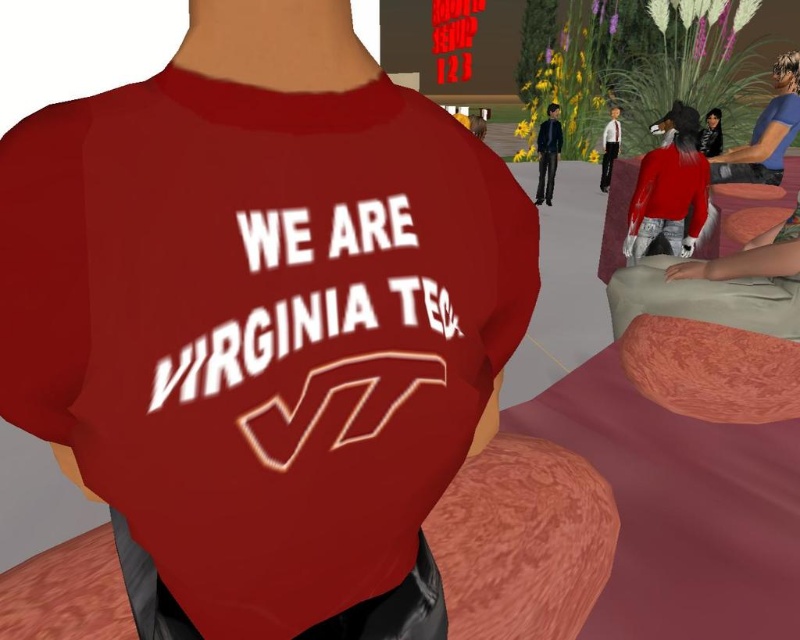
Which is behind, point (700, 168) or point (604, 189)?

The point (604, 189) is behind.

Between matte red shirt at center and matte white shirt at upper right, which one is positioned higher?

matte white shirt at upper right

Locate an element on the screen. matte red shirt at center is located at coordinates (670, 189).

Measure the distance between matte red shirt at center and camera.

The distance of matte red shirt at center from camera is 3.32 meters.

Does matte red shirt at center have a greater width compared to shiny black jacket at upper right?

In fact, matte red shirt at center might be narrower than shiny black jacket at upper right.

Locate an element on the screen. The width and height of the screenshot is (800, 640). matte red shirt at center is located at coordinates (670, 189).

At what (x,y) coordinates should I click in order to perform the action: click on matte red shirt at center. Please return your answer as a coordinate pair (x, y). This screenshot has height=640, width=800. Looking at the image, I should click on (670, 189).

Can you confirm if blue fabric shirt at upper right is shorter than matte white shirt at upper right?

No, blue fabric shirt at upper right is not shorter than matte white shirt at upper right.

Locate an element on the screen. This screenshot has height=640, width=800. blue fabric shirt at upper right is located at coordinates (766, 132).

What are the coordinates of `blue fabric shirt at upper right` in the screenshot? It's located at (766, 132).